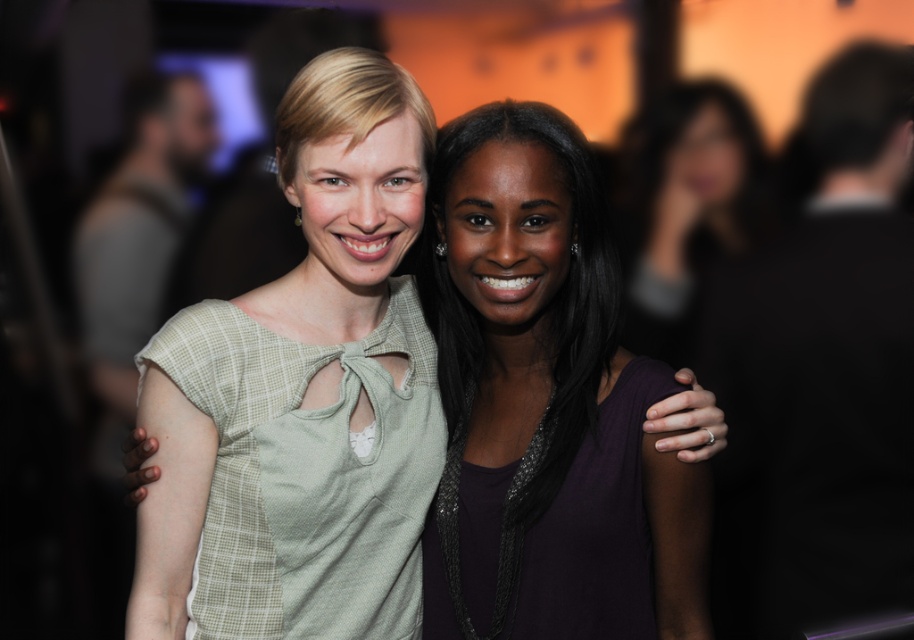
You are a photographer trying to decide where to place a third person in the frame. The two existing subjects are wearing the purple matte dress at center and the dark purple dress at center. Which dress is narrower so you can position the third person closer to it?

The purple matte dress at center is narrower than the dark purple dress at center, so you can position the third person closer to the purple matte dress at center.

You are a photographer trying to adjust the lighting for a photo shoot. You notice the purple matte dress at center and the light green fabric dress at center. Which dress is positioned to the right of the other?

The purple matte dress at center is positioned on the right side of the light green fabric dress at center, so it is to the right of the light green fabric dress at center.